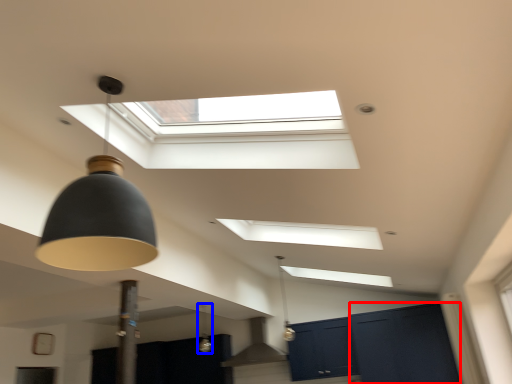
Question: Which object is closer to the camera taking this photo, glass door (highlighted by a red box) or lamp (highlighted by a blue box)?

Choices:
 (A) glass door
 (B) lamp

Answer: (B)